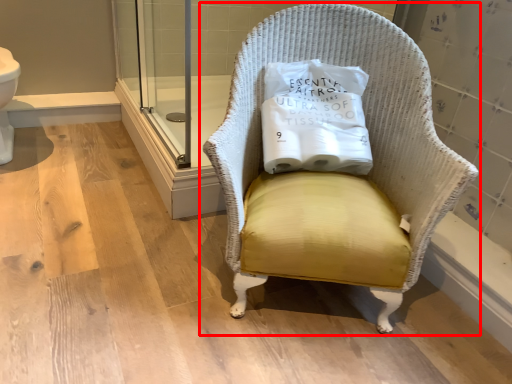
Question: From the image's perspective, what is the correct spatial positioning of chair (annotated by the red box) in reference to pillow?

Choices:
 (A) above
 (B) below

Answer: (B)